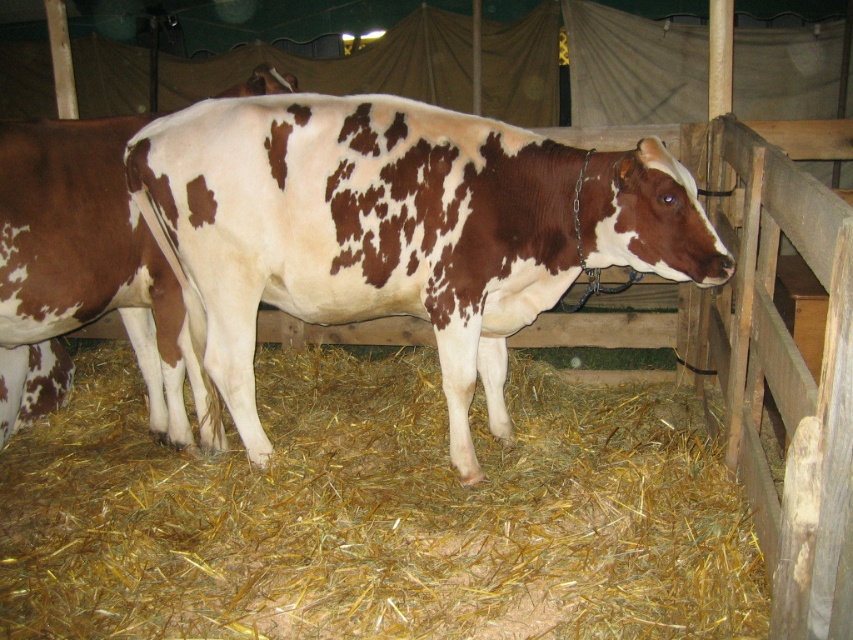
Does yellow straw at lower center have a lesser height compared to brown spotted cow at center?

Indeed, yellow straw at lower center has a lesser height compared to brown spotted cow at center.

Does yellow straw at lower center have a lesser width compared to brown spotted cow at center?

No, yellow straw at lower center is not thinner than brown spotted cow at center.

Does point (47, 579) come in front of point (520, 192)?

Yes, point (47, 579) is in front of point (520, 192).

Find the location of a particular element. The width and height of the screenshot is (853, 640). yellow straw at lower center is located at coordinates (376, 515).